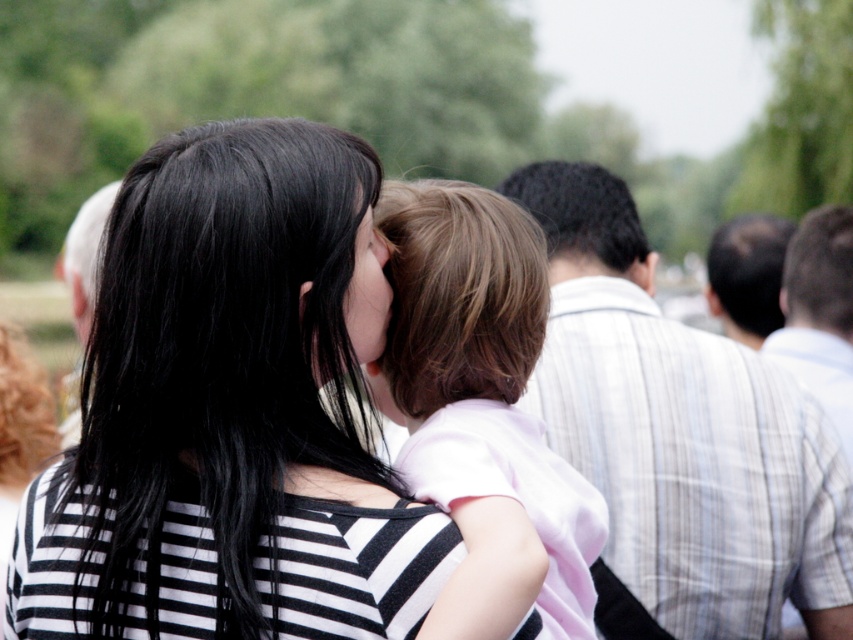
Measure the distance between black striped shirt at center and black curly hair at upper center.

The distance of black striped shirt at center from black curly hair at upper center is 5.75 feet.

Can you confirm if black striped shirt at center is taller than black curly hair at upper center?

Indeed, black striped shirt at center has a greater height compared to black curly hair at upper center.

The image size is (853, 640). What are the coordinates of `black striped shirt at center` in the screenshot? It's located at (227, 413).

Is the position of smooth gray shirt at upper right more distant than that of white hair at left?

Yes, smooth gray shirt at upper right is behind white hair at left.

Who is more distant from viewer, (708,275) or (73,273)?

The point (708,275) is behind.

This screenshot has width=853, height=640. Describe the element at coordinates (747, 275) in the screenshot. I see `smooth gray shirt at upper right` at that location.

I want to click on smooth gray shirt at upper right, so click(747, 275).

Is point (492, 276) closer to viewer compared to point (827, 317)?

That is True.

Is the position of light brown hair at center less distant than that of striped shirt at right?

Yes, light brown hair at center is closer to the viewer.

Is point (535, 488) farther from camera compared to point (775, 356)?

No, (535, 488) is in front of (775, 356).

The image size is (853, 640). Identify the location of light brown hair at center. (482, 410).